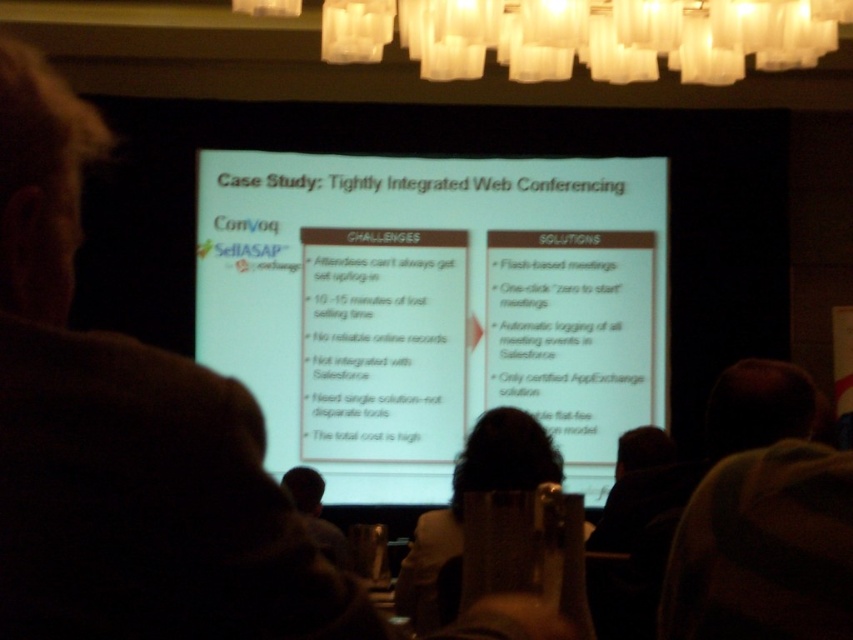
Question: Can you confirm if dark hair at upper left is bigger than brown hair at upper center?

Choices:
 (A) no
 (B) yes

Answer: (B)

Question: Which point is closer to the camera?

Choices:
 (A) (271, 508)
 (B) (764, 609)

Answer: (A)

Question: Considering the real-world distances, which object is closest to the brown hair at upper center?

Choices:
 (A) white glass chandelier at upper center
 (B) white fabric at center

Answer: (B)

Question: Which point is farther to the camera?

Choices:
 (A) (543, 24)
 (B) (96, 461)
 (C) (502, 444)

Answer: (C)

Question: Considering the relative positions of brown hair at upper center and white glass chandelier at upper center in the image provided, where is brown hair at upper center located with respect to white glass chandelier at upper center?

Choices:
 (A) above
 (B) below

Answer: (B)

Question: Does brown hair at upper center have a larger size compared to white glass chandelier at upper center?

Choices:
 (A) yes
 (B) no

Answer: (B)